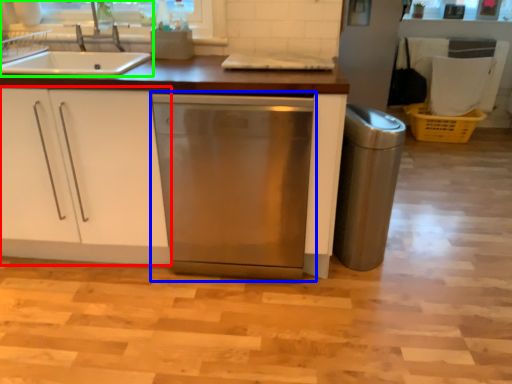
Question: Based on their relative distances, which object is nearer to cabinetry (highlighted by a red box)? Choose from home appliance (highlighted by a blue box) and kitchen appliance (highlighted by a green box).

Choices:
 (A) home appliance
 (B) kitchen appliance

Answer: (A)